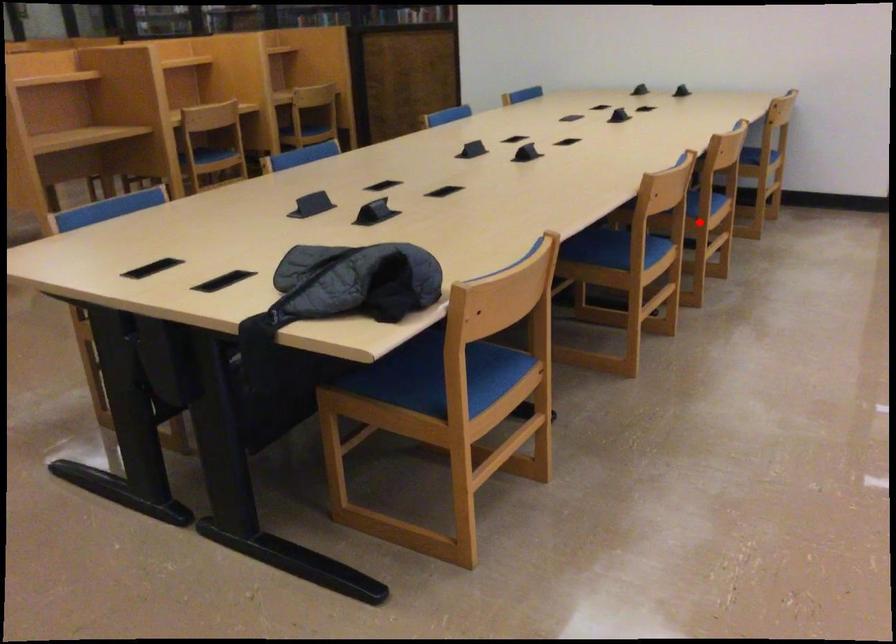
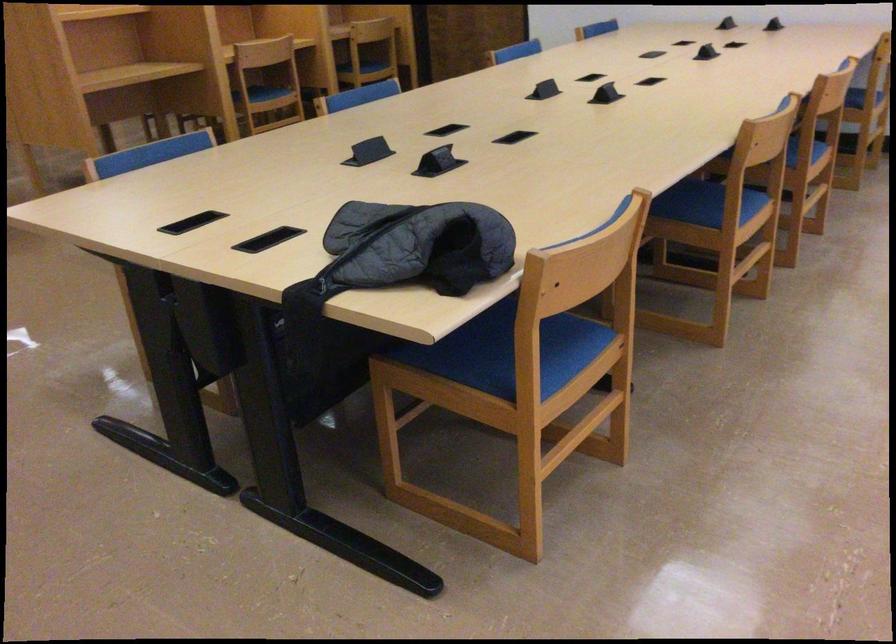
Find the pixel in the second image that matches the highlighted location in the first image.

(805, 171)